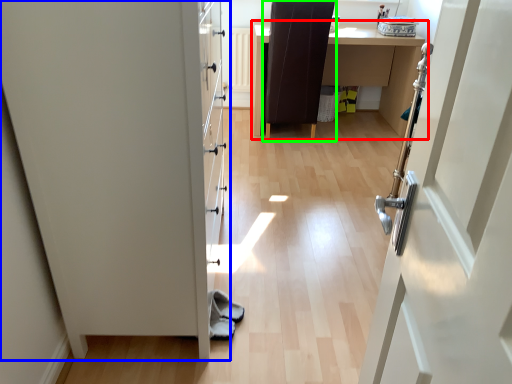
Question: Which object is positioned closest to table (highlighted by a red box)? Select from door (highlighted by a blue box) and chair (highlighted by a green box).

Choices:
 (A) door
 (B) chair

Answer: (B)